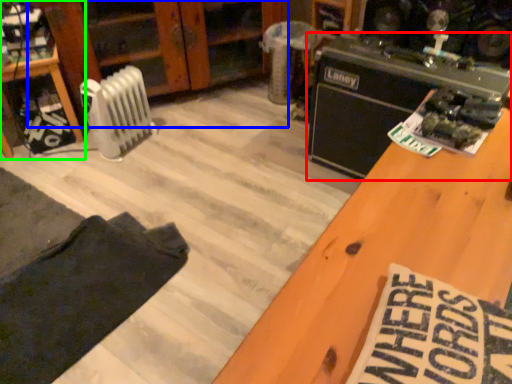
Question: Based on their relative distances, which object is farther from appliance (highlighted by a red box)? Choose from dresser (highlighted by a blue box) and furniture (highlighted by a green box).

Choices:
 (A) dresser
 (B) furniture

Answer: (B)